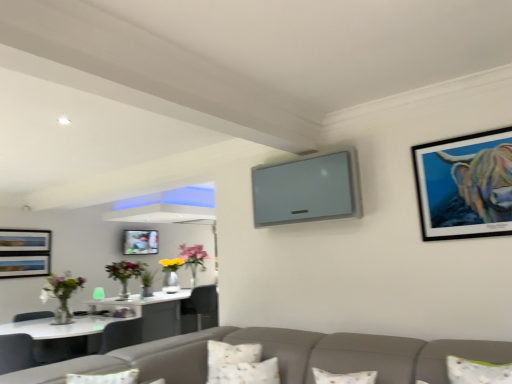
Find the location of `translucent glass vase at center, the second floral arrangement in the left-to-right sequence`. translucent glass vase at center, the second floral arrangement in the left-to-right sequence is located at coordinates (193, 259).

How much space does translucent glass vase at center, positioned as the 2th floral arrangement in front-to-back order, occupy vertically?

71.87 centimeters.

Describe the element at coordinates (245, 373) in the screenshot. Image resolution: width=512 pixels, height=384 pixels. I see `white textured pillow at lower center, acting as the second pillow starting from the back` at that location.

This screenshot has height=384, width=512. What do you see at coordinates (465, 185) in the screenshot?
I see `metallic black frame at upper right, positioned as the 2th picture frame in back-to-front order` at bounding box center [465, 185].

Measure the distance between point (x=453, y=219) and camera.

Point (x=453, y=219) and camera are 8.81 feet apart from each other.

Measure the distance between point (221,350) and camera.

They are 2.93 meters apart.

The width and height of the screenshot is (512, 384). In order to click on metallic silver picture frame at center, positioned as the 2th picture frame in front-to-back order in this screenshot , I will do `click(140, 242)`.

Where is `translucent glass vase with flowers at left, marked as the second floral arrangement in a back-to-front arrangement`? This screenshot has height=384, width=512. translucent glass vase with flowers at left, marked as the second floral arrangement in a back-to-front arrangement is located at coordinates (125, 274).

From a real-world perspective, who is located lower, white textured pillow at lower center, the 1th pillow positioned from the back, or metallic black frame at upper right, which is the first picture frame from right to left?

white textured pillow at lower center, the 1th pillow positioned from the back, from a real-world perspective.

The height and width of the screenshot is (384, 512). What are the coordinates of `picture frame that is on the right side of white textured pillow at lower center, the 1th pillow positioned from the back` in the screenshot? It's located at (465, 185).

Looking at this image, is white textured pillow at lower center, the 1th pillow positioned from the back, far away from metallic black frame at upper right, the second picture frame in the left-to-right sequence?

Absolutely, white textured pillow at lower center, the 1th pillow positioned from the back, is distant from metallic black frame at upper right, the second picture frame in the left-to-right sequence.

Which of these two, white textured pillow at lower center, the 1th pillow positioned from the back, or metallic black frame at upper right, the second picture frame in the left-to-right sequence, is thinner?

Thinner between the two is metallic black frame at upper right, the second picture frame in the left-to-right sequence.

Based on the photo, is white textured pillow at lower center, acting as the second pillow starting from the back, not inside metallic black frame at upper right, positioned as the 2th picture frame in back-to-front order?

Absolutely, white textured pillow at lower center, acting as the second pillow starting from the back, is external to metallic black frame at upper right, positioned as the 2th picture frame in back-to-front order.

Is point (232, 364) in front of point (459, 223)?

No, it is not.

From the metallic black frame at upper right, which is the first picture frame from right to left, count 1st pillows backward and point to it. Please provide its 2D coordinates.

[(245, 373)]

From the image's perspective, is white textured pillow at lower center, acting as the second pillow starting from the back, beneath metallic black frame at upper right, which is the first picture frame from top to bottom?

Correct, white textured pillow at lower center, acting as the second pillow starting from the back, appears lower than metallic black frame at upper right, which is the first picture frame from top to bottom, in the image.

In terms of height, does metallic black frame at upper right, positioned as the 2th picture frame in back-to-front order, look taller or shorter compared to metallic silver picture frame at center, the first picture frame positioned from the back?

Considering their sizes, metallic black frame at upper right, positioned as the 2th picture frame in back-to-front order, has more height than metallic silver picture frame at center, the first picture frame positioned from the back.

From the image's perspective, which one is positioned lower, metallic black frame at upper right, positioned as the 2th picture frame in back-to-front order, or metallic silver picture frame at center, positioned as the 2th picture frame in front-to-back order?

metallic silver picture frame at center, positioned as the 2th picture frame in front-to-back order, appears lower in the image.

Considering the relative sizes of metallic black frame at upper right, which is the first picture frame from top to bottom, and metallic silver picture frame at center, the first picture frame positioned from the back, in the image provided, is metallic black frame at upper right, which is the first picture frame from top to bottom, bigger than metallic silver picture frame at center, the first picture frame positioned from the back,?

No, metallic black frame at upper right, which is the first picture frame from top to bottom, is not bigger than metallic silver picture frame at center, the first picture frame positioned from the back.

Is white textured pillow at lower center, the 2th pillow in the front-to-back sequence, taller than translucent glass vase at center, positioned as the 2th floral arrangement in front-to-back order?

No, white textured pillow at lower center, the 2th pillow in the front-to-back sequence, is not taller than translucent glass vase at center, positioned as the 2th floral arrangement in front-to-back order.

Is white textured pillow at lower center, the 2th pillow in the front-to-back sequence, positioned with its back to translucent glass vase at center, arranged as the 1th floral arrangement when viewed from the back?

No, white textured pillow at lower center, the 2th pillow in the front-to-back sequence, is not facing the opposite direction of translucent glass vase at center, arranged as the 1th floral arrangement when viewed from the back.

Can you tell me how much white textured pillow at lower center, the 1th pillow positioned from the back, and translucent glass vase at center, the second floral arrangement in the left-to-right sequence, differ in facing direction?

75.8 degrees.

From a real-world perspective, which object stands above the other?

From a 3D spatial view, metallic black frame at upper right, the 2th picture frame in the bottom-to-top sequence, is above.

Can you tell me how much translucent glass vase with flowers at left, marked as the second floral arrangement in a back-to-front arrangement, and metallic black frame at upper right, the 2th picture frame in the bottom-to-top sequence, differ in facing direction?

The angle between the facing direction of translucent glass vase with flowers at left, marked as the second floral arrangement in a back-to-front arrangement, and the facing direction of metallic black frame at upper right, the 2th picture frame in the bottom-to-top sequence, is 90.4 degrees.

Looking at this image, is translucent glass vase with flowers at left, marked as the second floral arrangement in a back-to-front arrangement, not inside metallic black frame at upper right, the 2th picture frame in the bottom-to-top sequence?

translucent glass vase with flowers at left, marked as the second floral arrangement in a back-to-front arrangement, lies outside metallic black frame at upper right, the 2th picture frame in the bottom-to-top sequence,'s area.

Considering the sizes of objects translucent glass vase with flowers at left, which ranks as the first floral arrangement in front-to-back order, and metallic black frame at upper right, which is the first picture frame from right to left, in the image provided, who is thinner, translucent glass vase with flowers at left, which ranks as the first floral arrangement in front-to-back order, or metallic black frame at upper right, which is the first picture frame from right to left,?

metallic black frame at upper right, which is the first picture frame from right to left.

Is translucent glass vase with flowers at left, which ranks as the first floral arrangement in front-to-back order, looking in the opposite direction of white textured pillow at lower center, positioned as the 1th pillow in front-to-back order?

No.

Is translucent glass vase with flowers at left, which is counted as the first floral arrangement, starting from the left, positioned beyond the bounds of white textured pillow at lower center, acting as the second pillow starting from the back?

Yes.

Does translucent glass vase with flowers at left, the second floral arrangement when ordered from right to left, have a smaller size compared to white textured pillow at lower center, positioned as the 1th pillow in front-to-back order?

Incorrect, translucent glass vase with flowers at left, the second floral arrangement when ordered from right to left, is not smaller in size than white textured pillow at lower center, positioned as the 1th pillow in front-to-back order.

Which is more distant, (191, 266) or (151, 244)?

The point (191, 266) is behind.

Are translucent glass vase at center, arranged as the 1th floral arrangement when viewed from the back, and metallic silver picture frame at center, the 1th picture frame positioned from the bottom, making contact?

translucent glass vase at center, arranged as the 1th floral arrangement when viewed from the back, and metallic silver picture frame at center, the 1th picture frame positioned from the bottom, are clearly separated.

Considering the sizes of objects translucent glass vase at center, the second floral arrangement in the left-to-right sequence, and metallic silver picture frame at center, positioned as the 2th picture frame in front-to-back order, in the image provided, who is wider, translucent glass vase at center, the second floral arrangement in the left-to-right sequence, or metallic silver picture frame at center, positioned as the 2th picture frame in front-to-back order,?

With larger width is translucent glass vase at center, the second floral arrangement in the left-to-right sequence.

Based on their positions, is translucent glass vase at center, arranged as the 1th floral arrangement when viewed from the back, located to the left or right of metallic silver picture frame at center, placed as the second picture frame when sorted from top to bottom?

Clearly, translucent glass vase at center, arranged as the 1th floral arrangement when viewed from the back, is on the right of metallic silver picture frame at center, placed as the second picture frame when sorted from top to bottom, in the image.

From the image's perspective, which picture frame is the 2nd one above the white textured pillow at lower center, the 2th pillow in the front-to-back sequence? Please provide its 2D coordinates.

[(465, 185)]

I want to click on the 2nd pillow below the metallic black frame at upper right, which is the first picture frame from right to left (from a real-world perspective), so click(245, 373).

When comparing their distances from metallic black frame at upper right, which is the first picture frame from right to left, does white textured pillow at lower center, acting as the second pillow starting from the back, or translucent glass vase with flowers at left, which ranks as the first floral arrangement in front-to-back order, seem closer?

The object closer to metallic black frame at upper right, which is the first picture frame from right to left, is white textured pillow at lower center, acting as the second pillow starting from the back.

Looking at the image, which one is located closer to translucent glass vase at center, the second floral arrangement in the left-to-right sequence, metallic black frame at upper right, the first picture frame from the front, or white textured pillow at lower center, the 1th pillow positioned from the back?

Based on the image, white textured pillow at lower center, the 1th pillow positioned from the back, appears to be nearer to translucent glass vase at center, the second floral arrangement in the left-to-right sequence.

Based on their spatial positions, is translucent glass vase with flowers at left, which is counted as the first floral arrangement, starting from the left, or translucent glass vase at center, the second floral arrangement in the left-to-right sequence, closer to white textured pillow at lower center, the 2th pillow in the front-to-back sequence?

translucent glass vase with flowers at left, which is counted as the first floral arrangement, starting from the left, is positioned closer to the anchor white textured pillow at lower center, the 2th pillow in the front-to-back sequence.

Considering their positions, is white textured pillow at lower center, the 2th pillow in the front-to-back sequence, positioned closer to metallic black frame at upper right, the second picture frame in the left-to-right sequence, than translucent glass vase at center, placed as the 1th floral arrangement when sorted from right to left?

Based on the image, white textured pillow at lower center, the 2th pillow in the front-to-back sequence, appears to be nearer to metallic black frame at upper right, the second picture frame in the left-to-right sequence.

From the image, which object appears to be nearer to translucent glass vase at center, placed as the 1th floral arrangement when sorted from right to left, metallic silver picture frame at center, the first picture frame positioned from the back, or white textured pillow at lower center, the 1th pillow positioned from the back?

metallic silver picture frame at center, the first picture frame positioned from the back, lies closer to translucent glass vase at center, placed as the 1th floral arrangement when sorted from right to left, than the other object.

From the image, which object appears to be farther from translucent glass vase with flowers at left, which ranks as the first floral arrangement in front-to-back order, white textured pillow at lower center, the 2th pillow in the front-to-back sequence, or translucent glass vase at center, the second floral arrangement in the left-to-right sequence?

white textured pillow at lower center, the 2th pillow in the front-to-back sequence, is further to translucent glass vase with flowers at left, which ranks as the first floral arrangement in front-to-back order.

Considering their positions, is translucent glass vase with flowers at left, which is counted as the first floral arrangement, starting from the left, positioned closer to white textured pillow at lower center, the 2th pillow in the front-to-back sequence, than metallic silver picture frame at center, the 1th picture frame positioned from the bottom?

Among the two, translucent glass vase with flowers at left, which is counted as the first floral arrangement, starting from the left, is located nearer to white textured pillow at lower center, the 2th pillow in the front-to-back sequence.

When comparing their distances from white textured pillow at lower center, the 1th pillow positioned from the back, does metallic silver picture frame at center, the first picture frame positioned from the back, or white textured pillow at lower center, acting as the second pillow starting from the back, seem closer?

white textured pillow at lower center, acting as the second pillow starting from the back, is closer to white textured pillow at lower center, the 1th pillow positioned from the back.

Locate an element on the screen. The image size is (512, 384). pillow located between white textured pillow at lower center, acting as the second pillow starting from the back, and translucent glass vase with flowers at left, marked as the second floral arrangement in a back-to-front arrangement, in the depth direction is located at coordinates (229, 356).

Where is `pillow between white textured pillow at lower center, acting as the second pillow starting from the back, and translucent glass vase at center, arranged as the 1th floral arrangement when viewed from the back, in the front-back direction`? Image resolution: width=512 pixels, height=384 pixels. pillow between white textured pillow at lower center, acting as the second pillow starting from the back, and translucent glass vase at center, arranged as the 1th floral arrangement when viewed from the back, in the front-back direction is located at coordinates (229, 356).

This screenshot has height=384, width=512. What are the coordinates of `pillow between white textured pillow at lower center, acting as the second pillow starting from the back, and metallic silver picture frame at center, positioned as the 2th picture frame in front-to-back order, in the front-back direction` in the screenshot? It's located at (229, 356).

Where is `floral arrangement between metallic black frame at upper right, which is the first picture frame from right to left, and translucent glass vase at center, the second floral arrangement in the left-to-right sequence, from front to back`? The width and height of the screenshot is (512, 384). floral arrangement between metallic black frame at upper right, which is the first picture frame from right to left, and translucent glass vase at center, the second floral arrangement in the left-to-right sequence, from front to back is located at coordinates (125, 274).